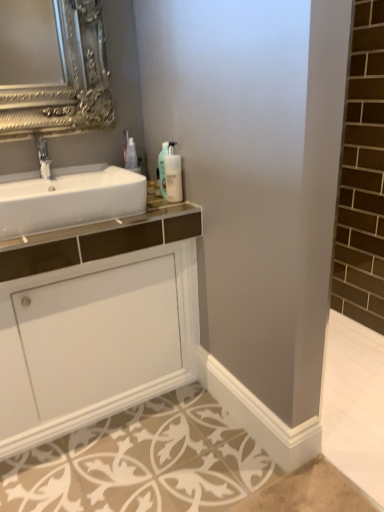
Question: Is translucent plastic soap dispenser at upper center, the second soap dispenser from the right, at the right side of white painted wood baseboard at lower center?

Choices:
 (A) yes
 (B) no

Answer: (B)

Question: Can you confirm if translucent plastic soap dispenser at upper center, acting as the first soap dispenser starting from the left, is positioned to the left of white painted wood baseboard at lower center?

Choices:
 (A) no
 (B) yes

Answer: (B)

Question: Is white painted wood baseboard at lower center surrounded by translucent plastic soap dispenser at upper center, the second soap dispenser from the right?

Choices:
 (A) yes
 (B) no

Answer: (B)

Question: Does translucent plastic soap dispenser at upper center, the second soap dispenser from the right, have a greater width compared to white painted wood baseboard at lower center?

Choices:
 (A) no
 (B) yes

Answer: (B)

Question: Is translucent plastic soap dispenser at upper center, the second soap dispenser from the right, looking in the opposite direction of white painted wood baseboard at lower center?

Choices:
 (A) no
 (B) yes

Answer: (A)

Question: From the image's perspective, is translucent plastic soap dispenser at upper center, the second soap dispenser from the right, under white painted wood baseboard at lower center?

Choices:
 (A) yes
 (B) no

Answer: (B)

Question: Is translucent plastic soap dispenser at upper center, which is the 1th soap dispenser from right to left, bigger than white glossy sink at left?

Choices:
 (A) no
 (B) yes

Answer: (A)

Question: From a real-world perspective, is translucent plastic soap dispenser at upper center, which is the 1th soap dispenser from right to left, over white glossy sink at left?

Choices:
 (A) no
 (B) yes

Answer: (B)

Question: From the image's perspective, does translucent plastic soap dispenser at upper center, the 2th soap dispenser from the left, appear lower than white glossy sink at left?

Choices:
 (A) yes
 (B) no

Answer: (B)

Question: From a real-world perspective, is translucent plastic soap dispenser at upper center, which is the 1th soap dispenser from right to left, beneath white glossy sink at left?

Choices:
 (A) yes
 (B) no

Answer: (B)

Question: Is the surface of translucent plastic soap dispenser at upper center, which is the 1th soap dispenser from right to left, in direct contact with white glossy sink at left?

Choices:
 (A) no
 (B) yes

Answer: (A)

Question: Is translucent plastic soap dispenser at upper center, which is the 1th soap dispenser from right to left, oriented away from white glossy sink at left?

Choices:
 (A) no
 (B) yes

Answer: (A)

Question: From a real-world perspective, does translucent plastic soap dispenser at upper center, which is the 1th soap dispenser from right to left, sit lower than white glossy cabinet at center?

Choices:
 (A) yes
 (B) no

Answer: (B)